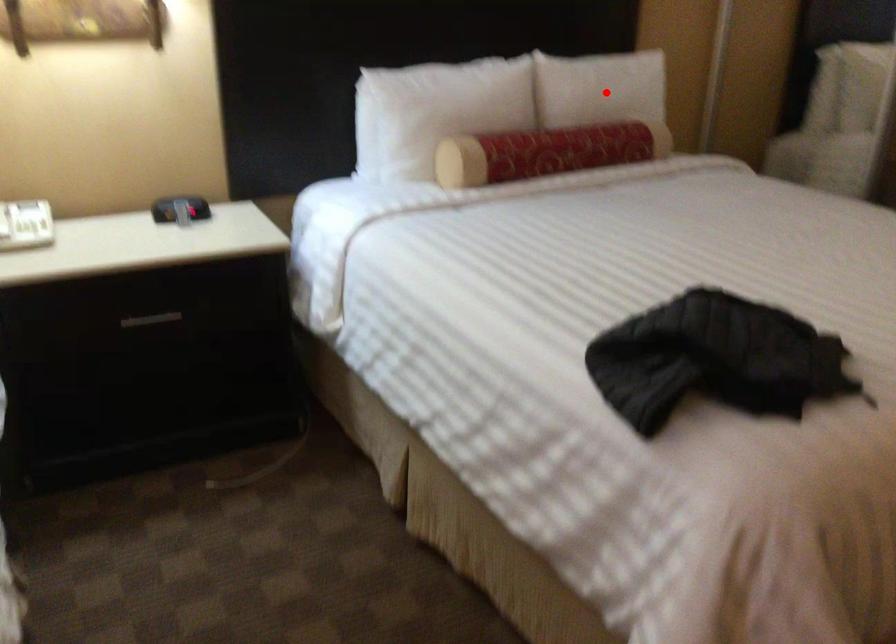
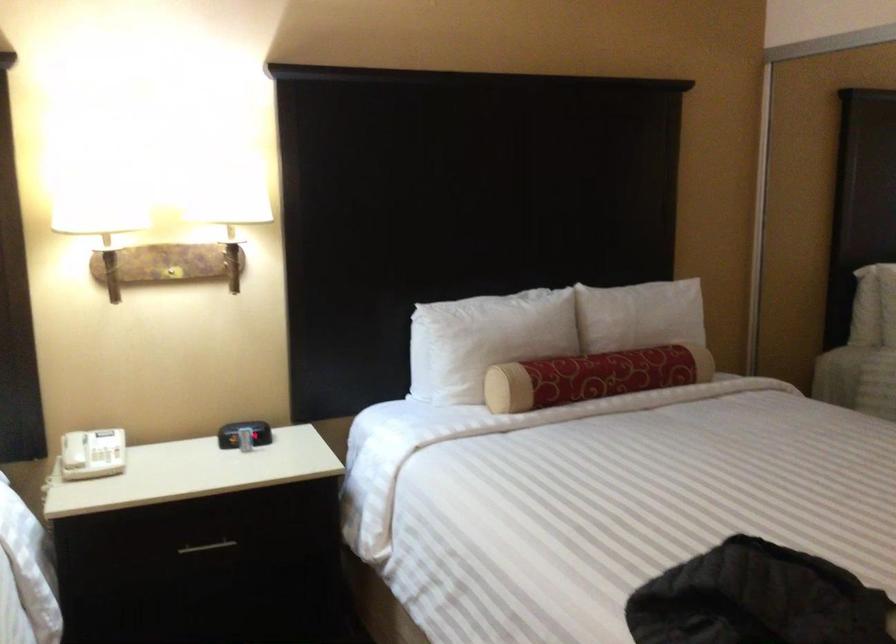
In the second image, find the point that corresponds to the highlighted location in the first image.

(643, 319)